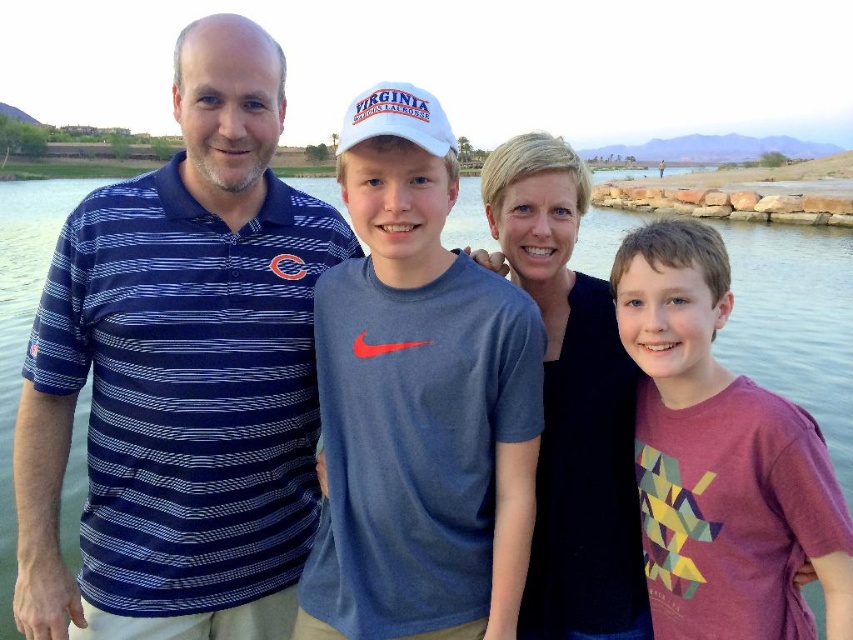
Is point (425, 596) positioned after point (827, 310)?

No, it is in front of (827, 310).

Between point (491, 632) and point (759, 365), which one is positioned in front?

Point (491, 632)

The image size is (853, 640). In order to click on blue cotton t-shirt at center in this screenshot , I will do `click(418, 401)`.

Identify the location of blue cotton t-shirt at center. (418, 401).

Does blue striped polo shirt at left appear over black matte shirt at center?

Yes.

Based on the photo, does blue striped polo shirt at left appear on the left side of black matte shirt at center?

Indeed, blue striped polo shirt at left is positioned on the left side of black matte shirt at center.

Is point (247, 288) less distant than point (547, 228)?

That is True.

Identify the location of blue striped polo shirt at left. This screenshot has width=853, height=640. (180, 374).

Consider the image. Which is below, blue cotton t-shirt at center or black matte shirt at center?

blue cotton t-shirt at center

Who is more distant from viewer, (407, 328) or (486, 168)?

Point (486, 168)

At what (x,y) coordinates should I click in order to perform the action: click on blue cotton t-shirt at center. Please return your answer as a coordinate pair (x, y). Looking at the image, I should click on (418, 401).